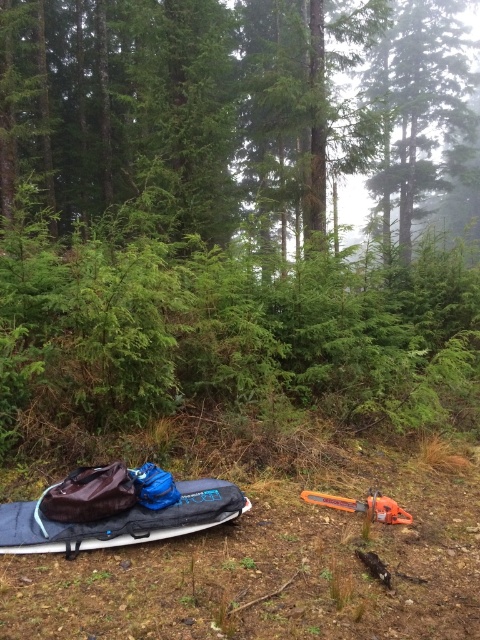
Question: Can you confirm if green matte tree at upper center is positioned below orange plastic chainsaw at lower right?

Choices:
 (A) no
 (B) yes

Answer: (A)

Question: Is green matte tree at upper center thinner than orange plastic chainsaw at lower right?

Choices:
 (A) yes
 (B) no

Answer: (B)

Question: Considering the real-world distances, which object is closest to the dark blue fabric kayak at lower left?

Choices:
 (A) green matte tree at upper center
 (B) green matte tree at center
 (C) orange plastic chainsaw at lower right

Answer: (C)

Question: Can you confirm if dark blue fabric kayak at lower left is positioned to the left of orange plastic chainsaw at lower right?

Choices:
 (A) no
 (B) yes

Answer: (B)

Question: Among these points, which one is farthest from the camera?

Choices:
 (A) (237, 508)
 (B) (389, 113)
 (C) (376, 497)

Answer: (B)

Question: Which of the following is the farthest from the observer?

Choices:
 (A) orange plastic chainsaw at lower right
 (B) green matte tree at center

Answer: (B)